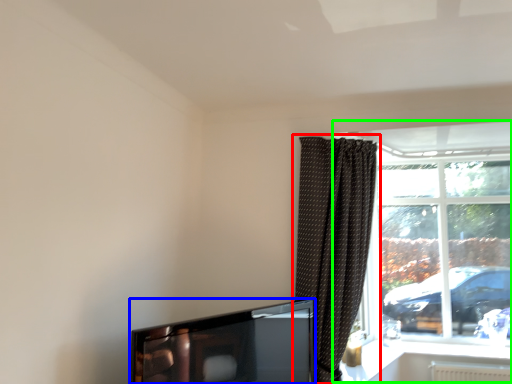
Question: Which object is the farthest from curtain (highlighted by a red box)? Choose among these: television (highlighted by a blue box) or window (highlighted by a green box).

Choices:
 (A) television
 (B) window

Answer: (B)